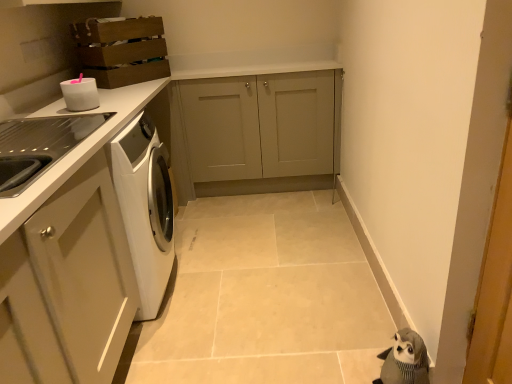
I want to click on free spot above matte gray cabinet at center, the second cabinetry viewed from the left (from a real-world perspective), so click(240, 67).